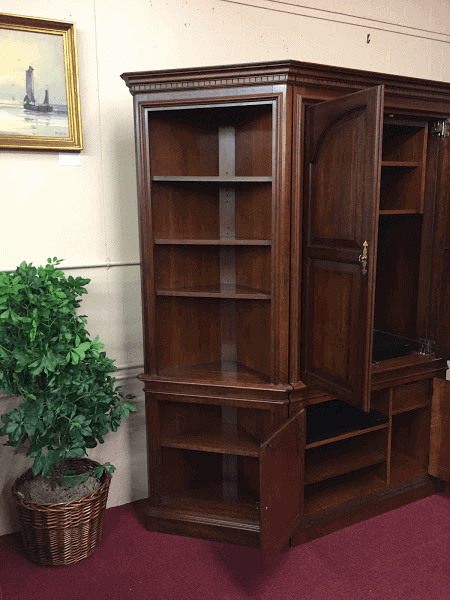
Find the location of `door`. door is located at coordinates (336, 197).